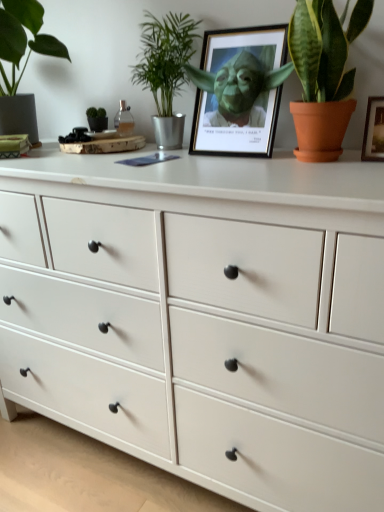
Identify the location of matte black picture frame at center. Image resolution: width=384 pixels, height=512 pixels. (239, 91).

Image resolution: width=384 pixels, height=512 pixels. Describe the element at coordinates (165, 70) in the screenshot. I see `green leafy plant at upper center, acting as the 2th houseplant starting from the left` at that location.

This screenshot has height=512, width=384. Identify the location of green matte plant at left, positioned as the third houseplant in right-to-left order. click(21, 58).

What is the approximate height of white wood chest of drawers at center?

The height of white wood chest of drawers at center is 37.35 inches.

Image resolution: width=384 pixels, height=512 pixels. I want to click on matte black picture frame at center, so click(x=239, y=91).

Who is bigger, matte black picture frame at center or white wood chest of drawers at center?

white wood chest of drawers at center.

Consider the image. Is matte black picture frame at center far from white wood chest of drawers at center?

Actually, matte black picture frame at center and white wood chest of drawers at center are a little close together.

From their relative heights in the image, would you say matte black picture frame at center is taller or shorter than white wood chest of drawers at center?

matte black picture frame at center is shorter than white wood chest of drawers at center.

From the image's perspective, is matte black picture frame at center located above white wood chest of drawers at center?

Yes, from the image's perspective, matte black picture frame at center is over white wood chest of drawers at center.

Which object is closer to the camera, green matte plant at left, positioned as the third houseplant in right-to-left order, or white wood chest of drawers at center?

Positioned in front is white wood chest of drawers at center.

Is green matte plant at left, positioned as the third houseplant in right-to-left order, not inside white wood chest of drawers at center?

Indeed, green matte plant at left, positioned as the third houseplant in right-to-left order, is completely outside white wood chest of drawers at center.

Is green matte plant at left, the first houseplant from the left, oriented away from white wood chest of drawers at center?

No, green matte plant at left, the first houseplant from the left, is not facing the opposite direction of white wood chest of drawers at center.

Measure the distance from white wood chest of drawers at center to green glossy leafy plant at upper right, the 1th houseplant from the right.

A distance of 19.60 inches exists between white wood chest of drawers at center and green glossy leafy plant at upper right, the 1th houseplant from the right.

Is white wood chest of drawers at center beside green glossy leafy plant at upper right, the 1th houseplant from the right?

white wood chest of drawers at center is not next to green glossy leafy plant at upper right, the 1th houseplant from the right, and they're not touching.

Which is farther from the camera, [132,268] or [362,27]?

Positioned behind is point [132,268].

From a real-world perspective, which is physically below, white wood chest of drawers at center or green glossy leafy plant at upper right, the 1th houseplant from the right?

In real-world perspective, white wood chest of drawers at center is lower.

Is green leafy plant at upper center, acting as the 2th houseplant starting from the left, outside of green glossy leafy plant at upper right, the 1th houseplant from the right?

Yes, green leafy plant at upper center, acting as the 2th houseplant starting from the left, is located beyond the bounds of green glossy leafy plant at upper right, the 1th houseplant from the right.

Is green leafy plant at upper center, marked as the 2th houseplant in a right-to-left arrangement, aimed at green glossy leafy plant at upper right, the 1th houseplant from the right?

No, green leafy plant at upper center, marked as the 2th houseplant in a right-to-left arrangement, is not aimed at green glossy leafy plant at upper right, the 1th houseplant from the right.

In the image, is green leafy plant at upper center, marked as the 2th houseplant in a right-to-left arrangement, positioned in front of or behind green glossy leafy plant at upper right, the 1th houseplant from the right?

Visually, green leafy plant at upper center, marked as the 2th houseplant in a right-to-left arrangement, is located behind green glossy leafy plant at upper right, the 1th houseplant from the right.

From a real-world perspective, is green leafy plant at upper center, acting as the 2th houseplant starting from the left, above or below green glossy leafy plant at upper right, the 1th houseplant from the right?

From a real-world perspective, green leafy plant at upper center, acting as the 2th houseplant starting from the left, is physically above green glossy leafy plant at upper right, the 1th houseplant from the right.

From a real-world perspective, is green glossy leafy plant at upper right, the 3th houseplant positioned from the left, physically located above or below green matte plant at left, the first houseplant from the left?

From a real-world perspective, green glossy leafy plant at upper right, the 3th houseplant positioned from the left, is physically below green matte plant at left, the first houseplant from the left.

Does green glossy leafy plant at upper right, the 3th houseplant positioned from the left, have a smaller size compared to green matte plant at left, the first houseplant from the left?

Indeed, green glossy leafy plant at upper right, the 3th houseplant positioned from the left, has a smaller size compared to green matte plant at left, the first houseplant from the left.

Does green glossy leafy plant at upper right, the 1th houseplant from the right, have a lesser height compared to green matte plant at left, positioned as the third houseplant in right-to-left order?

Indeed, green glossy leafy plant at upper right, the 1th houseplant from the right, has a lesser height compared to green matte plant at left, positioned as the third houseplant in right-to-left order.

From the image's perspective, is green glossy leafy plant at upper right, the 1th houseplant from the right, on top of green matte plant at left, positioned as the third houseplant in right-to-left order?

No, from the image's perspective, green glossy leafy plant at upper right, the 1th houseplant from the right, is not on top of green matte plant at left, positioned as the third houseplant in right-to-left order.

Can you confirm if green leafy plant at upper center, acting as the 2th houseplant starting from the left, is bigger than matte black picture frame at center?

No.

Considering the sizes of green leafy plant at upper center, acting as the 2th houseplant starting from the left, and matte black picture frame at center in the image, is green leafy plant at upper center, acting as the 2th houseplant starting from the left, taller or shorter than matte black picture frame at center?

In the image, green leafy plant at upper center, acting as the 2th houseplant starting from the left, appears to be taller than matte black picture frame at center.

Is green leafy plant at upper center, marked as the 2th houseplant in a right-to-left arrangement, oriented towards matte black picture frame at center?

No.

Considering the relative sizes of matte black picture frame at center and green matte plant at left, positioned as the third houseplant in right-to-left order, in the image provided, is matte black picture frame at center wider than green matte plant at left, positioned as the third houseplant in right-to-left order,?

No.

Between matte black picture frame at center and green matte plant at left, positioned as the third houseplant in right-to-left order, which one has larger size?

Bigger between the two is green matte plant at left, positioned as the third houseplant in right-to-left order.

From the image's perspective, which one is positioned higher, matte black picture frame at center or green matte plant at left, the first houseplant from the left?

green matte plant at left, the first houseplant from the left, appears higher in the image.

There is a white wood chest of drawers at center. Where is `picture frame above it (from a real-world perspective)`? Image resolution: width=384 pixels, height=512 pixels. picture frame above it (from a real-world perspective) is located at coordinates (239, 91).

The height and width of the screenshot is (512, 384). In order to click on the chest of drawers below the green matte plant at left, positioned as the third houseplant in right-to-left order (from the image's perspective) in this screenshot , I will do `click(203, 317)`.

Looking at the image, which one is located closer to green leafy plant at upper center, marked as the 2th houseplant in a right-to-left arrangement, green matte plant at left, the first houseplant from the left, or matte black picture frame at center?

matte black picture frame at center lies closer to green leafy plant at upper center, marked as the 2th houseplant in a right-to-left arrangement, than the other object.

Looking at the image, which one is located closer to matte black picture frame at center, green glossy leafy plant at upper right, the 3th houseplant positioned from the left, or white wood chest of drawers at center?

Based on the image, green glossy leafy plant at upper right, the 3th houseplant positioned from the left, appears to be nearer to matte black picture frame at center.

Estimate the real-world distances between objects in this image. Which object is closer to green glossy leafy plant at upper right, the 1th houseplant from the right, matte black picture frame at center or green matte plant at left, the first houseplant from the left?

Based on the image, matte black picture frame at center appears to be nearer to green glossy leafy plant at upper right, the 1th houseplant from the right.

Looking at the image, which one is located further to matte black picture frame at center, green glossy leafy plant at upper right, the 1th houseplant from the right, or green matte plant at left, positioned as the third houseplant in right-to-left order?

green matte plant at left, positioned as the third houseplant in right-to-left order, is positioned further to the anchor matte black picture frame at center.

Estimate the real-world distances between objects in this image. Which object is further from green glossy leafy plant at upper right, the 3th houseplant positioned from the left, white wood chest of drawers at center or green matte plant at left, the first houseplant from the left?

green matte plant at left, the first houseplant from the left, is positioned further to the anchor green glossy leafy plant at upper right, the 3th houseplant positioned from the left.

Looking at this image, estimate the real-world distances between objects in this image. Which object is further from white wood chest of drawers at center, green glossy leafy plant at upper right, the 3th houseplant positioned from the left, or green leafy plant at upper center, marked as the 2th houseplant in a right-to-left arrangement?

green leafy plant at upper center, marked as the 2th houseplant in a right-to-left arrangement, is further to white wood chest of drawers at center.

Looking at the image, which one is located closer to matte black picture frame at center, green matte plant at left, positioned as the third houseplant in right-to-left order, or green leafy plant at upper center, marked as the 2th houseplant in a right-to-left arrangement?

Based on the image, green leafy plant at upper center, marked as the 2th houseplant in a right-to-left arrangement, appears to be nearer to matte black picture frame at center.

Based on their spatial positions, is green leafy plant at upper center, acting as the 2th houseplant starting from the left, or green matte plant at left, the first houseplant from the left, further from green glossy leafy plant at upper right, the 1th houseplant from the right?

green matte plant at left, the first houseplant from the left, lies further to green glossy leafy plant at upper right, the 1th houseplant from the right, than the other object.

Locate an element on the screen. The height and width of the screenshot is (512, 384). picture frame between green matte plant at left, positioned as the third houseplant in right-to-left order, and green glossy leafy plant at upper right, the 1th houseplant from the right, from left to right is located at coordinates (239, 91).

Locate an element on the screen. The image size is (384, 512). picture frame between green matte plant at left, positioned as the third houseplant in right-to-left order, and white wood chest of drawers at center from top to bottom is located at coordinates (239, 91).

Where is `houseplant between green leafy plant at upper center, marked as the 2th houseplant in a right-to-left arrangement, and white wood chest of drawers at center from top to bottom`? The height and width of the screenshot is (512, 384). houseplant between green leafy plant at upper center, marked as the 2th houseplant in a right-to-left arrangement, and white wood chest of drawers at center from top to bottom is located at coordinates (323, 75).

The image size is (384, 512). In order to click on picture frame situated between green leafy plant at upper center, marked as the 2th houseplant in a right-to-left arrangement, and green glossy leafy plant at upper right, the 3th houseplant positioned from the left, from left to right in this screenshot , I will do `click(239, 91)`.